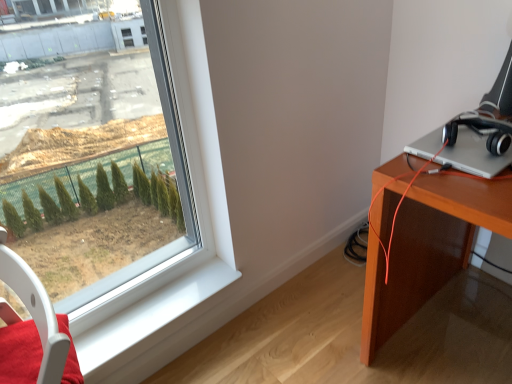
Identify the location of silver metallic laptop at upper right. (473, 155).

What do you see at coordinates (473, 155) in the screenshot? I see `silver metallic laptop at upper right` at bounding box center [473, 155].

Image resolution: width=512 pixels, height=384 pixels. What do you see at coordinates (178, 254) in the screenshot?
I see `clear glass window at left` at bounding box center [178, 254].

Describe the element at coordinates (482, 128) in the screenshot. I see `black matte headphones at right` at that location.

Where is `silver metallic laptop at upper right`? This screenshot has height=384, width=512. silver metallic laptop at upper right is located at coordinates (473, 155).

Considering the relative positions of white plastic swivel chair at lower left and silver metallic laptop at upper right in the image provided, is white plastic swivel chair at lower left to the left of silver metallic laptop at upper right from the viewer's perspective?

Yes, white plastic swivel chair at lower left is to the left of silver metallic laptop at upper right.

From a real-world perspective, between white plastic swivel chair at lower left and silver metallic laptop at upper right, who is vertically higher?

From a 3D spatial view, silver metallic laptop at upper right is above.

Considering the sizes of objects white plastic swivel chair at lower left and silver metallic laptop at upper right in the image provided, who is wider, white plastic swivel chair at lower left or silver metallic laptop at upper right?

Wider between the two is silver metallic laptop at upper right.

Who is shorter, silver metallic laptop at upper right or clear glass window at left?

With less height is silver metallic laptop at upper right.

The image size is (512, 384). I want to click on laptop on the right side of clear glass window at left, so click(x=473, y=155).

In the scene shown: Is silver metallic laptop at upper right turned away from clear glass window at left?

No, silver metallic laptop at upper right is not facing away from clear glass window at left.

Is silver metallic laptop at upper right inside the boundaries of clear glass window at left, or outside?

silver metallic laptop at upper right is spatially situated outside clear glass window at left.

Considering the relative positions of black matte headphones at right and clear glass window at left in the image provided, is black matte headphones at right to the left or to the right of clear glass window at left?

In the image, black matte headphones at right appears on the right side of clear glass window at left.

Is clear glass window at left inside black matte headphones at right?

That's incorrect, clear glass window at left is not inside black matte headphones at right.

From the image's perspective, between black matte headphones at right and clear glass window at left, who is located below?

clear glass window at left, from the image's perspective.

I want to click on window below the black matte headphones at right (from the image's perspective), so click(x=178, y=254).

Is white glossy window sill at lower left at the left side of clear glass window at left?

No.

From a real-world perspective, is white glossy window sill at lower left beneath clear glass window at left?

Indeed, from a real-world perspective, white glossy window sill at lower left is positioned beneath clear glass window at left.

Is there a large distance between white glossy window sill at lower left and clear glass window at left?

No, white glossy window sill at lower left is not far away from clear glass window at left.

From the image's perspective, between white glossy window sill at lower left and clear glass window at left, which one is located above?

clear glass window at left appears higher in the image.

Which of these two, white plastic swivel chair at lower left or clear glass window at left, is thinner?

clear glass window at left.

Considering the relative positions of white plastic swivel chair at lower left and clear glass window at left in the image provided, is white plastic swivel chair at lower left to the left or to the right of clear glass window at left?

Based on their positions, white plastic swivel chair at lower left is located to the left of clear glass window at left.

From a real-world perspective, is white plastic swivel chair at lower left positioned above or below clear glass window at left?

white plastic swivel chair at lower left is situated lower than clear glass window at left in the real world.

Which of these two, silver metallic laptop at upper right or black matte headphones at right, stands taller?

black matte headphones at right is taller.

From a real-world perspective, who is located higher, silver metallic laptop at upper right or black matte headphones at right?

black matte headphones at right, from a real-world perspective.

Does point (438, 161) appear closer or farther from the camera than point (495, 117)?

Clearly, point (438, 161) is closer to the camera than point (495, 117).

Based on the photo, from the image's perspective, between clear glass window at left and white plastic swivel chair at lower left, who is located below?

white plastic swivel chair at lower left is shown below in the image.

Which object is wider, clear glass window at left or white plastic swivel chair at lower left?

With larger width is white plastic swivel chair at lower left.

Looking at this image, from a real-world perspective, relative to white plastic swivel chair at lower left, is clear glass window at left vertically above or below?

Clearly, from a real-world perspective, clear glass window at left is above white plastic swivel chair at lower left.

At what (x,y) coordinates should I click in order to perform the action: click on swivel chair below the silver metallic laptop at upper right (from a real-world perspective). Please return your answer as a coordinate pair (x, y). The image size is (512, 384). Looking at the image, I should click on (36, 312).

Find the location of `window located in front of the silver metallic laptop at upper right`. window located in front of the silver metallic laptop at upper right is located at coordinates (178, 254).

Considering their positions, is white plastic swivel chair at lower left positioned further to clear glass window at left than silver metallic laptop at upper right?

Among the two, silver metallic laptop at upper right is located further to clear glass window at left.

Considering their positions, is white plastic swivel chair at lower left positioned closer to white glossy window sill at lower left than silver metallic laptop at upper right?

white plastic swivel chair at lower left is positioned closer to the anchor white glossy window sill at lower left.

From the image, which object appears to be nearer to black matte headphones at right, white plastic swivel chair at lower left or silver metallic laptop at upper right?

silver metallic laptop at upper right is positioned closer to the anchor black matte headphones at right.

When comparing their distances from silver metallic laptop at upper right, does black matte headphones at right or white glossy window sill at lower left seem closer?

black matte headphones at right lies closer to silver metallic laptop at upper right than the other object.

Based on their spatial positions, is black matte headphones at right or silver metallic laptop at upper right closer to white plastic swivel chair at lower left?

Based on the image, silver metallic laptop at upper right appears to be nearer to white plastic swivel chair at lower left.

From the image, which object appears to be nearer to silver metallic laptop at upper right, black matte headphones at right or clear glass window at left?

black matte headphones at right.

Which object lies nearer to the anchor point white plastic swivel chair at lower left, white glossy window sill at lower left or black matte headphones at right?

white glossy window sill at lower left.

Estimate the real-world distances between objects in this image. Which object is further from white plastic swivel chair at lower left, white glossy window sill at lower left or silver metallic laptop at upper right?

Among the two, silver metallic laptop at upper right is located further to white plastic swivel chair at lower left.

You are a GUI agent. You are given a task and a screenshot of the screen. Output one action in this format:
    pyautogui.click(x=<x>, y=<y>)
    Task: Click on the window between white plastic swivel chair at lower left and white glossy window sill at lower left along the z-axis
    
    Given the screenshot: What is the action you would take?
    pyautogui.click(x=178, y=254)

Image resolution: width=512 pixels, height=384 pixels. In order to click on headphones between white plastic swivel chair at lower left and silver metallic laptop at upper right in this screenshot , I will do tap(482, 128).

Identify the location of window between white plastic swivel chair at lower left and silver metallic laptop at upper right. The width and height of the screenshot is (512, 384). (178, 254).

You are a GUI agent. You are given a task and a screenshot of the screen. Output one action in this format:
    pyautogui.click(x=<x>, y=<y>)
    Task: Click on the headphones located between white glossy window sill at lower left and silver metallic laptop at upper right in the left-right direction
    This screenshot has height=384, width=512.
    Given the screenshot: What is the action you would take?
    pyautogui.click(x=482, y=128)